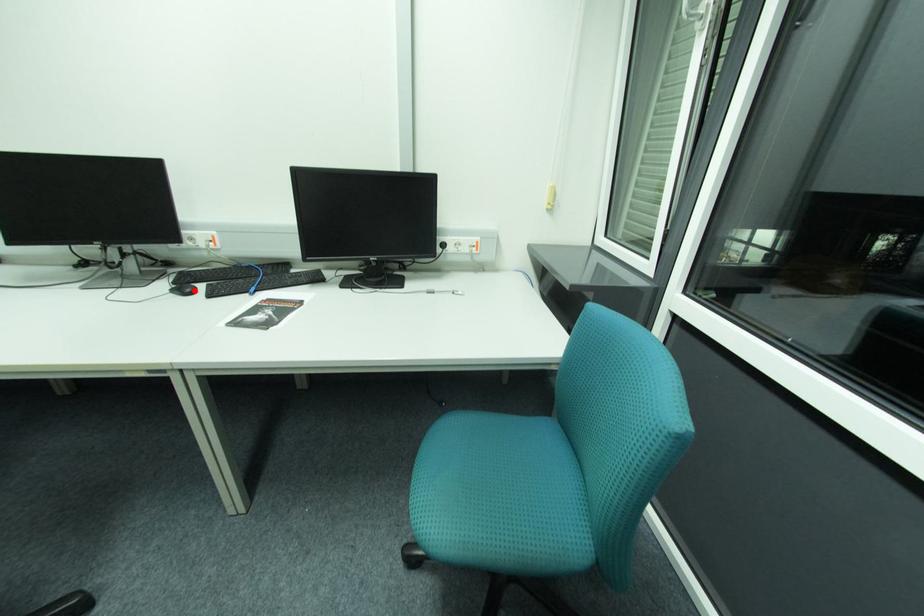
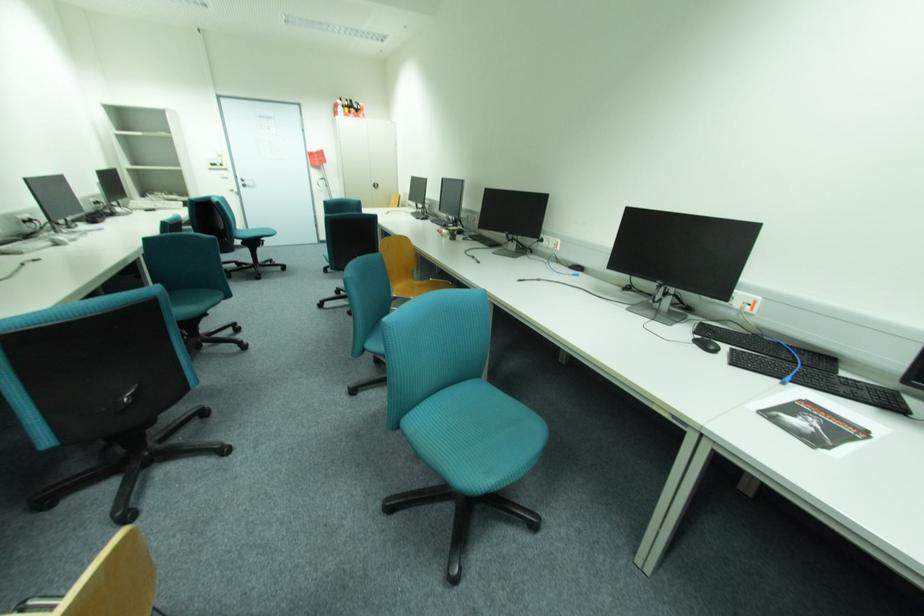
The point at the highlighted location is marked in the first image. Where is the corresponding point in the second image?

(716, 347)